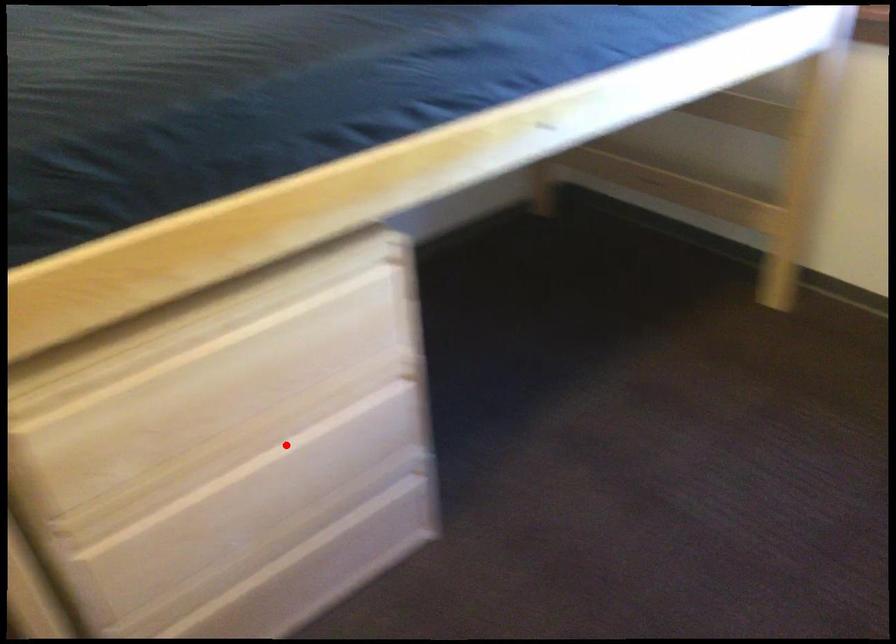
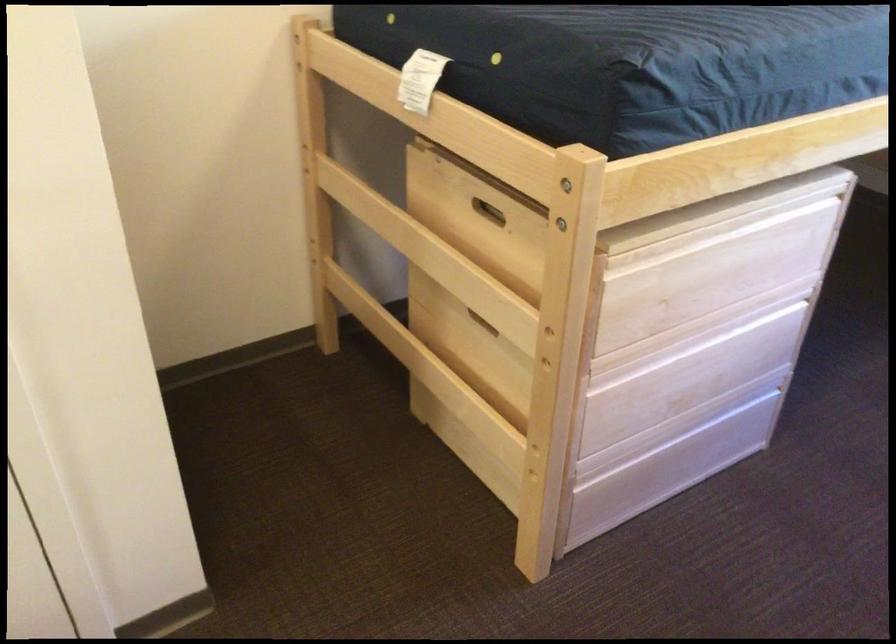
The point at the highlighted location is marked in the first image. Where is the corresponding point in the second image?

(718, 342)